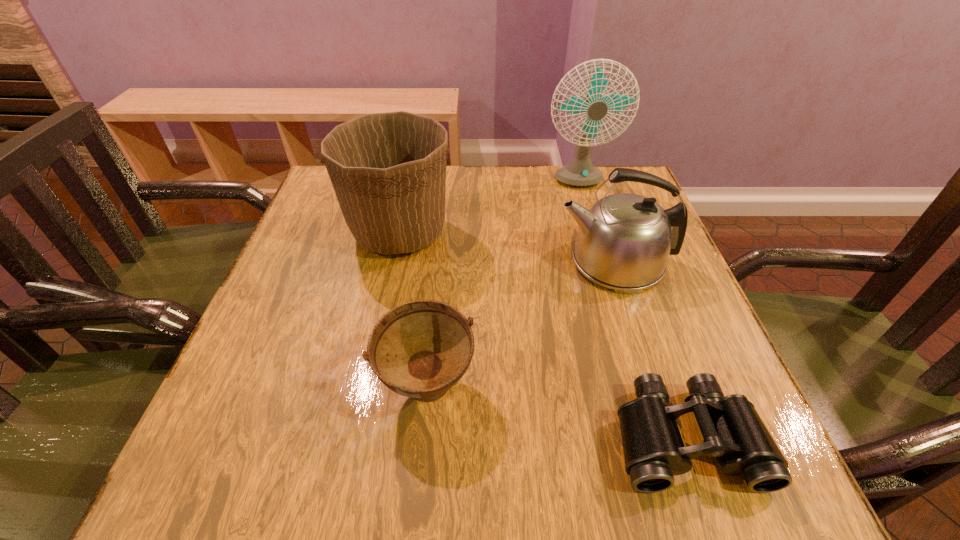
Find the location of a particular element. Image resolution: width=960 pixels, height=540 pixels. object at the far right corner is located at coordinates (580, 172).

This screenshot has height=540, width=960. Find the location of `object that is at the near right corner`. object that is at the near right corner is located at coordinates (733, 432).

This screenshot has width=960, height=540. In the image, there is a desktop. Identify the location of blank space at the far edge. (459, 194).

The image size is (960, 540). Identify the location of free spot at the near edge of the desktop. (544, 458).

Where is `vacant area at the left edge of the desktop`? The height and width of the screenshot is (540, 960). vacant area at the left edge of the desktop is located at coordinates (309, 274).

Where is `free space at the near right corner of the desktop`? The height and width of the screenshot is (540, 960). free space at the near right corner of the desktop is located at coordinates (690, 472).

The width and height of the screenshot is (960, 540). Identify the location of vacant area that lies between the fourth tallest object and the kettle. (520, 325).

Identify the location of free point between the binoculars and the soup bowl. (556, 413).

Find the location of `vacant point located between the fan and the shortest object`. vacant point located between the fan and the shortest object is located at coordinates (632, 310).

This screenshot has width=960, height=540. Find the location of `vacant space that is in between the binoculars and the tallest object`. vacant space that is in between the binoculars and the tallest object is located at coordinates (632, 310).